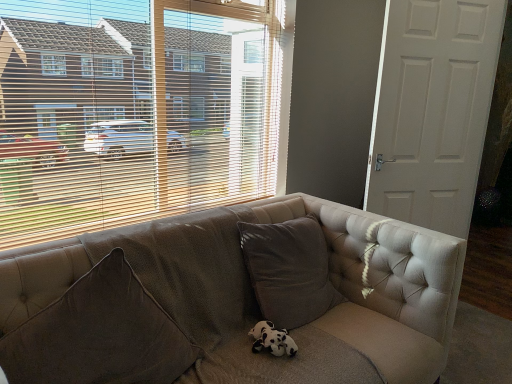
Question: Is the surface of black and white plush at center in direct contact with tufted fabric couch at center?

Choices:
 (A) yes
 (B) no

Answer: (B)

Question: Does black and white plush at center have a greater height compared to tufted fabric couch at center?

Choices:
 (A) yes
 (B) no

Answer: (B)

Question: Is black and white plush at center outside of tufted fabric couch at center?

Choices:
 (A) no
 (B) yes

Answer: (A)

Question: Would you consider black and white plush at center to be distant from tufted fabric couch at center?

Choices:
 (A) yes
 (B) no

Answer: (B)

Question: Is black and white plush at center wider than tufted fabric couch at center?

Choices:
 (A) no
 (B) yes

Answer: (A)

Question: Can you confirm if black and white plush at center is bigger than tufted fabric couch at center?

Choices:
 (A) no
 (B) yes

Answer: (A)

Question: Is black and white plush at center to the left of brown textured pillow at lower left from the viewer's perspective?

Choices:
 (A) no
 (B) yes

Answer: (A)

Question: Is black and white plush at center shorter than brown textured pillow at lower left?

Choices:
 (A) no
 (B) yes

Answer: (B)

Question: Considering the relative sizes of black and white plush at center and brown textured pillow at lower left in the image provided, is black and white plush at center smaller than brown textured pillow at lower left?

Choices:
 (A) no
 (B) yes

Answer: (B)

Question: Does black and white plush at center have a larger size compared to brown textured pillow at lower left?

Choices:
 (A) no
 (B) yes

Answer: (A)

Question: Does black and white plush at center lie behind brown textured pillow at lower left?

Choices:
 (A) no
 (B) yes

Answer: (B)

Question: Is black and white plush at center facing towards brown textured pillow at lower left?

Choices:
 (A) no
 (B) yes

Answer: (A)

Question: Is tufted fabric couch at center oriented towards wooden blinds at upper left?

Choices:
 (A) yes
 (B) no

Answer: (B)